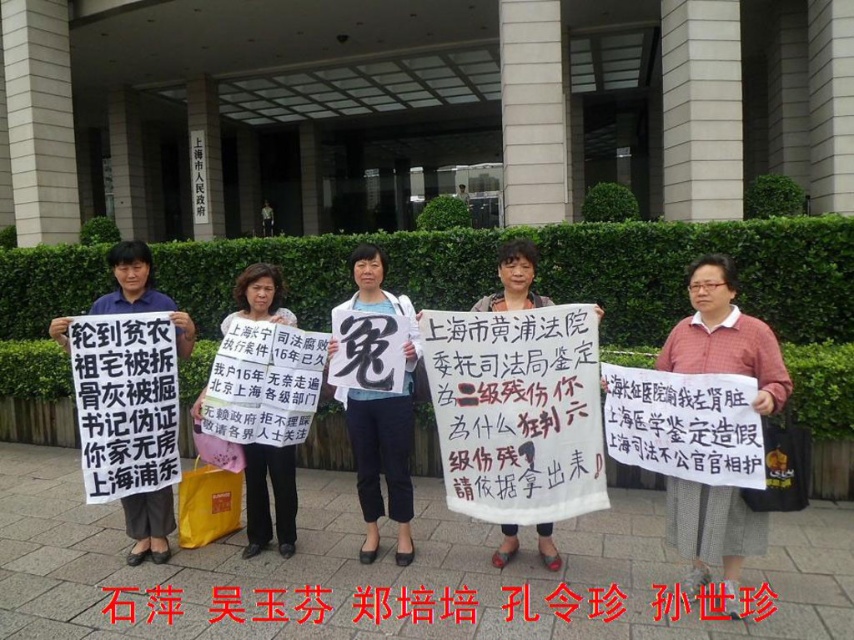
Between point (344, 404) and point (275, 500), which one is positioned in front?

Positioned in front is point (344, 404).

Which of these two, white paper sign at center or pink fabric sign at center, stands taller?

white paper sign at center

Is point (407, 449) more distant than point (250, 467)?

No, (407, 449) is in front of (250, 467).

The width and height of the screenshot is (854, 640). I want to click on white paper sign at center, so click(x=383, y=456).

Is pink checkered shirt at center shorter than white paper sign at center?

Correct, pink checkered shirt at center is not as tall as white paper sign at center.

Can you confirm if pink checkered shirt at center is wider than white paper sign at center?

In fact, pink checkered shirt at center might be narrower than white paper sign at center.

Is point (670, 480) closer to camera compared to point (390, 513)?

Yes, it is in front of point (390, 513).

This screenshot has height=640, width=854. What are the coordinates of `pink checkered shirt at center` in the screenshot? It's located at (724, 337).

Does pink checkered shirt at center have a lesser width compared to pink fabric sign at center?

No.

Is point (759, 349) positioned in front of point (256, 300)?

Yes, point (759, 349) is in front of point (256, 300).

Locate an element on the screen. This screenshot has height=640, width=854. pink checkered shirt at center is located at coordinates (724, 337).